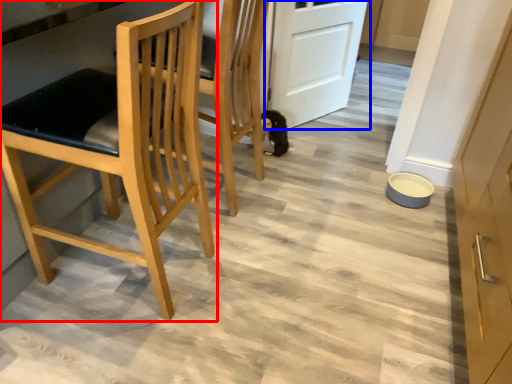
Question: Which object is closer to the camera taking this photo, chair (highlighted by a red box) or door (highlighted by a blue box)?

Choices:
 (A) chair
 (B) door

Answer: (A)